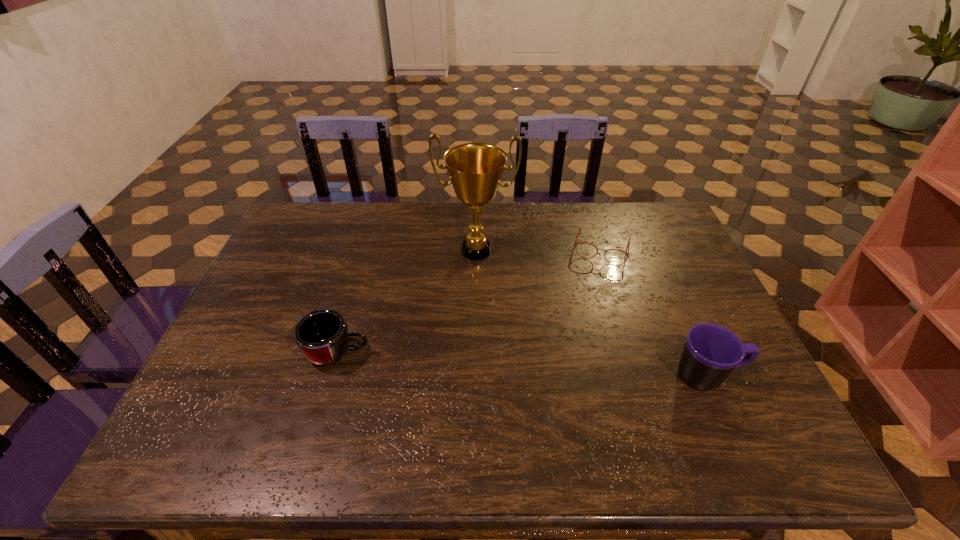
The height and width of the screenshot is (540, 960). I want to click on vacant space on the desktop that is between the leftmost object and the third shortest object and is positioned on the face of the spectacles, so click(571, 367).

You are a GUI agent. You are given a task and a screenshot of the screen. Output one action in this format:
    pyautogui.click(x=<x>, y=<y>)
    Task: Click on the vacant space on the desktop that is between the leftmost object and the second tallest object and is positioned on the front view with handles of the award
    Image resolution: width=960 pixels, height=540 pixels.
    Given the screenshot: What is the action you would take?
    pyautogui.click(x=467, y=361)